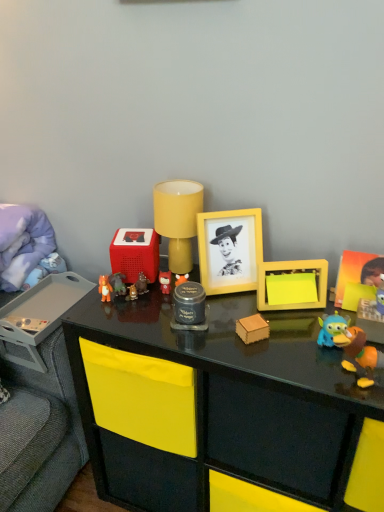
Locate an element on the screen. This screenshot has height=512, width=384. vacant space that is to the left of wooden block at center, which is counted as the fourth toy, starting from the right is located at coordinates [204, 347].